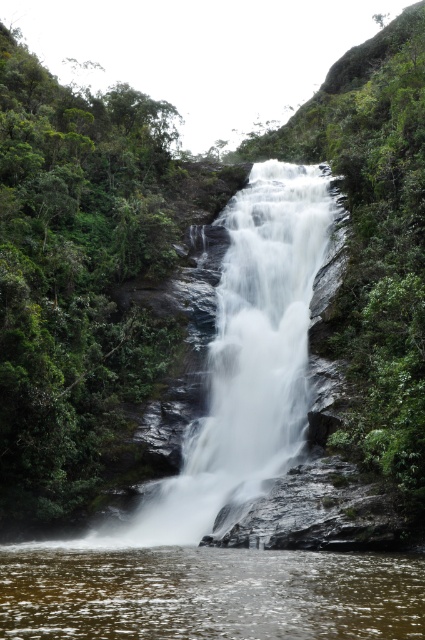
Question: Considering the real-world distances, which object is farthest from the clear water at center?

Choices:
 (A) white smooth waterfall at center
 (B) green leafy foliage at left

Answer: (B)

Question: Which of the following is the closest to the observer?

Choices:
 (A) clear water at center
 (B) green leafy foliage at left
 (C) white smooth waterfall at center

Answer: (A)

Question: Which of the following is the farthest from the observer?

Choices:
 (A) green leafy foliage at left
 (B) white smooth waterfall at center
 (C) clear water at center

Answer: (A)

Question: Can you confirm if green leafy foliage at left is bigger than white smooth waterfall at center?

Choices:
 (A) yes
 (B) no

Answer: (A)

Question: From the image, what is the correct spatial relationship of green leafy foliage at left in relation to clear water at center?

Choices:
 (A) right
 (B) left

Answer: (B)

Question: Is white smooth waterfall at center bigger than clear water at center?

Choices:
 (A) yes
 (B) no

Answer: (A)